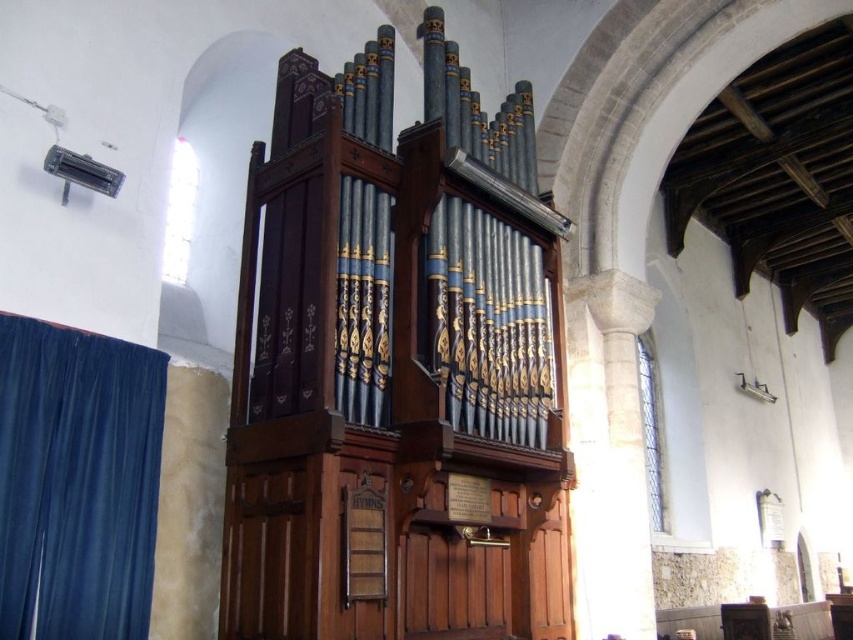
Question: Which point is farther from the camera taking this photo?

Choices:
 (A) (550, 243)
 (B) (67, 392)

Answer: (A)

Question: Is wooden pipe organ at center bigger than velvet blue curtain at left?

Choices:
 (A) no
 (B) yes

Answer: (B)

Question: Is wooden pipe organ at center positioned behind velvet blue curtain at left?

Choices:
 (A) yes
 (B) no

Answer: (A)

Question: Is wooden pipe organ at center further to the viewer compared to velvet blue curtain at left?

Choices:
 (A) no
 (B) yes

Answer: (B)

Question: Which point is closer to the camera?

Choices:
 (A) (401, 326)
 (B) (132, 524)

Answer: (B)